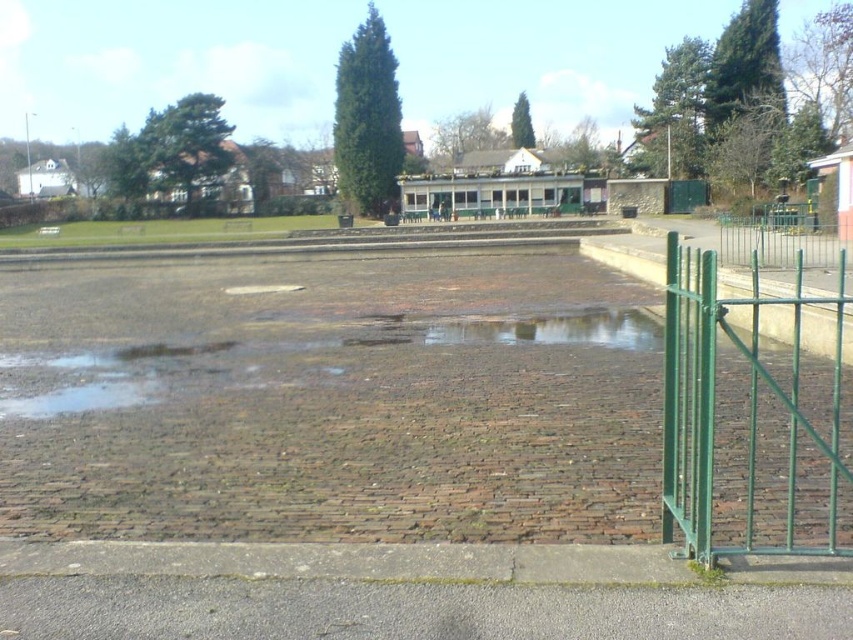
Question: Which point is closer to the camera?

Choices:
 (A) green painted metal gate at right
 (B) shiny brown puddle at center
 (C) green metal fence at right

Answer: (A)

Question: Among these points, which one is farthest from the camera?

Choices:
 (A) (612, 330)
 (B) (763, 218)

Answer: (B)

Question: Does shiny brown puddle at center appear under green metal fence at right?

Choices:
 (A) no
 (B) yes

Answer: (B)

Question: Considering the real-world distances, which object is closest to the shiny brown puddle at center?

Choices:
 (A) green painted metal gate at right
 (B) green metal fence at right

Answer: (A)

Question: Observing the image, what is the correct spatial positioning of green painted metal gate at right in reference to green metal fence at right?

Choices:
 (A) left
 (B) right

Answer: (A)

Question: Is green painted metal gate at right thinner than green metal fence at right?

Choices:
 (A) yes
 (B) no

Answer: (A)